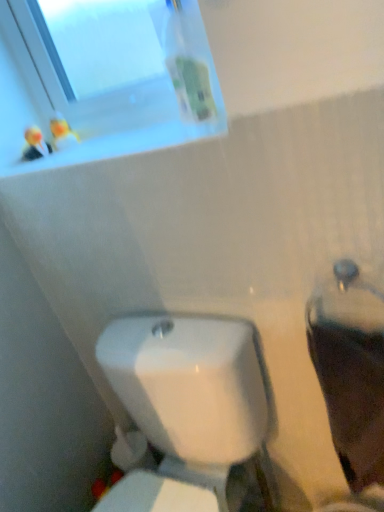
Question: From the image's perspective, is matte white toilet at right positioned above or below white glossy toilet at lower center?

Choices:
 (A) below
 (B) above

Answer: (B)

Question: Considering the relative positions of matte white toilet at right and white glossy toilet at lower center in the image provided, is matte white toilet at right to the left or to the right of white glossy toilet at lower center?

Choices:
 (A) right
 (B) left

Answer: (A)

Question: Which of these objects is positioned farthest from the white glossy toilet at lower center?

Choices:
 (A) matte white toilet at right
 (B) transparent glass window at upper left

Answer: (B)

Question: Estimate the real-world distances between objects in this image. Which object is closer to the matte white toilet at right?

Choices:
 (A) white glossy toilet at lower center
 (B) transparent glass window at upper left

Answer: (A)